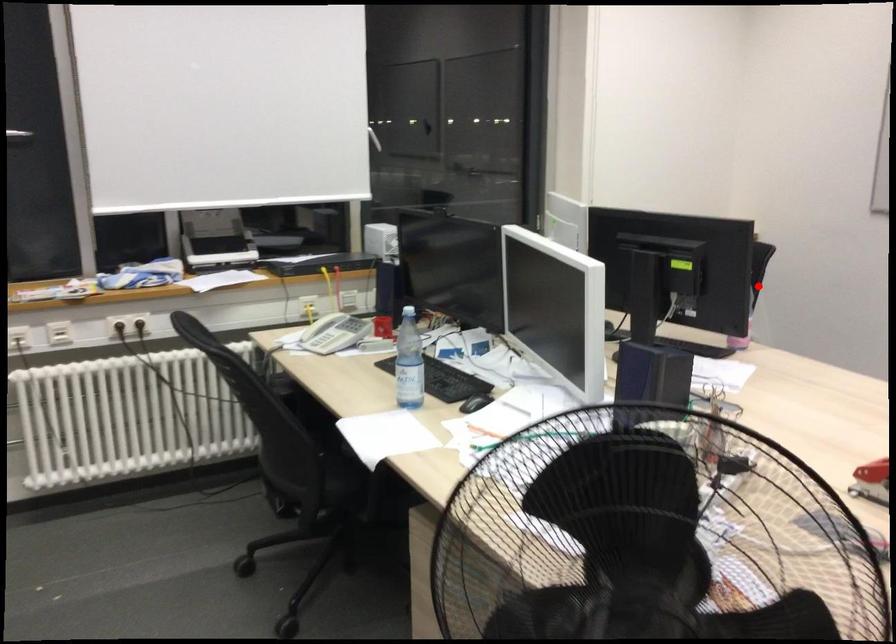
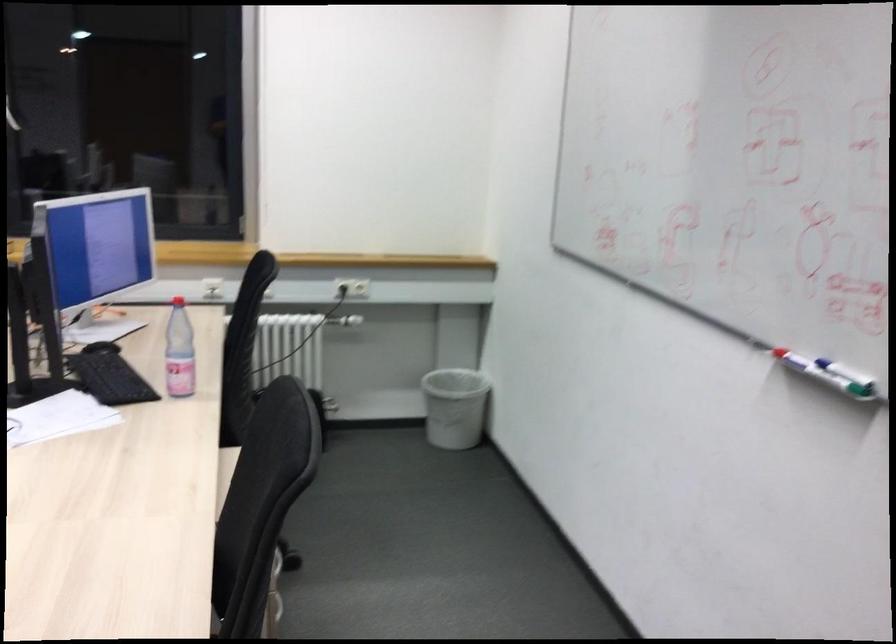
Question: I am providing you with two images of the same scene from different viewpoints. A red point is shown in image1. For the corresponding object point in image2, is it positioned nearer or farther from the camera?

Choices:
 (A) Nearer
 (B) Farther

Answer: (A)